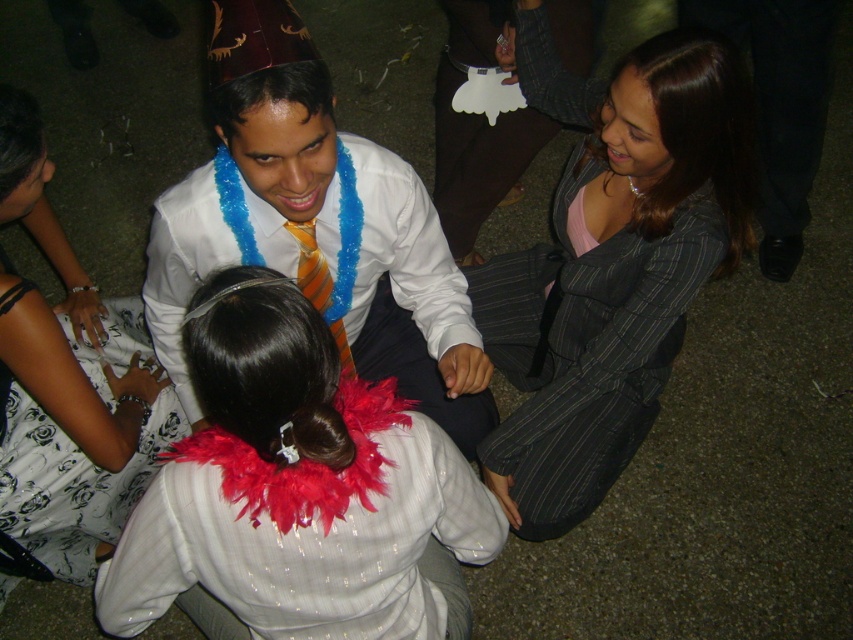
You are a GUI agent. You are given a task and a screenshot of the screen. Output one action in this format:
    pyautogui.click(x=<x>, y=<y>)
    Task: Click on the white feather boa at center
    
    Given the screenshot: What is the action you would take?
    pyautogui.click(x=299, y=488)

Between white feather boa at center and white satin shirt at center, which one is positioned lower?

white feather boa at center is lower down.

Image resolution: width=853 pixels, height=640 pixels. I want to click on white feather boa at center, so click(299, 488).

Can you confirm if gray pinstripe suit at center is smaller than orangestriped fabrictie at center?

Actually, gray pinstripe suit at center might be larger than orangestriped fabrictie at center.

Is point (546, 304) more distant than point (302, 260)?

Yes.

I want to click on gray pinstripe suit at center, so click(611, 262).

Which is in front, point (146, 364) or point (300, 266)?

Point (300, 266) is in front.

Who is more forward, [25,449] or [300,285]?

Point [300,285] is in front.

This screenshot has height=640, width=853. Find the location of `white floral dress at lower left`. white floral dress at lower left is located at coordinates (68, 381).